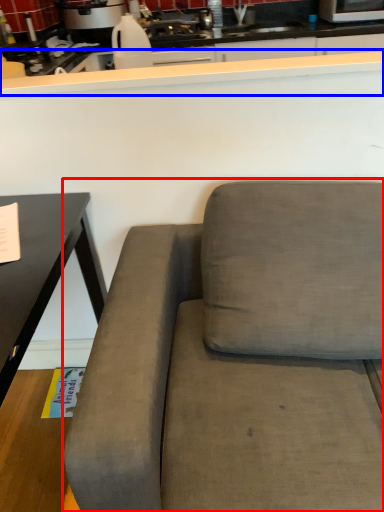
Question: Which point is closer to the camera, studio couch (highlighted by a red box) or counter top (highlighted by a blue box)?

Choices:
 (A) studio couch
 (B) counter top

Answer: (A)